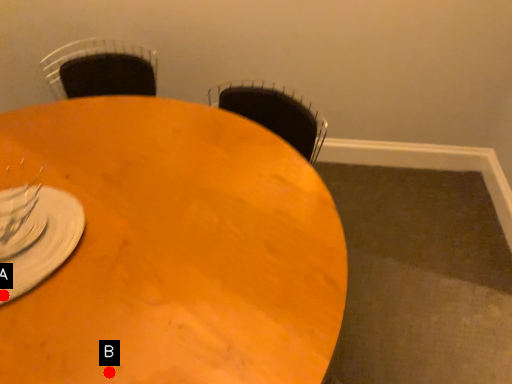
Question: Two points are circled on the image, labeled by A and B beside each circle. Among these points, which one is nearest to the camera?

Choices:
 (A) A is closer
 (B) B is closer

Answer: (B)